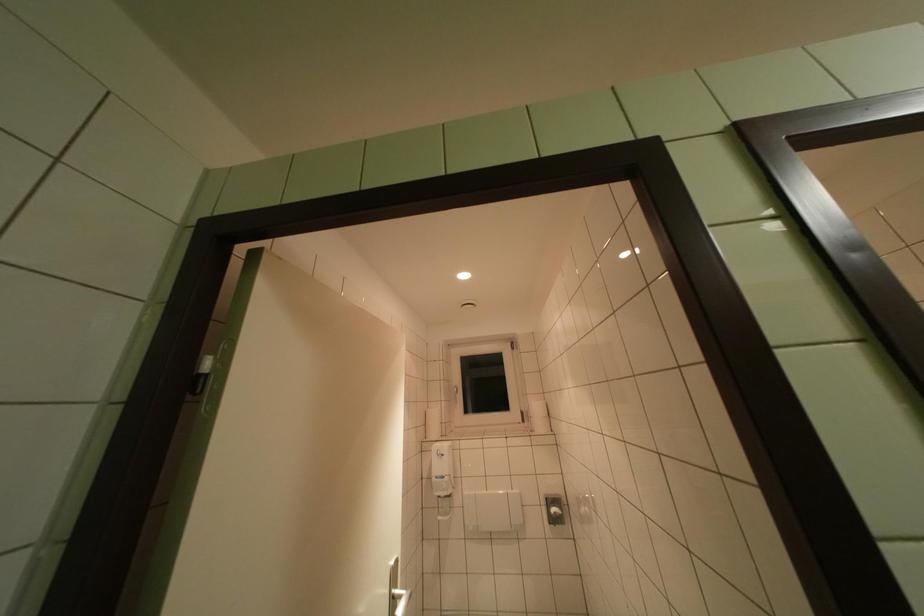
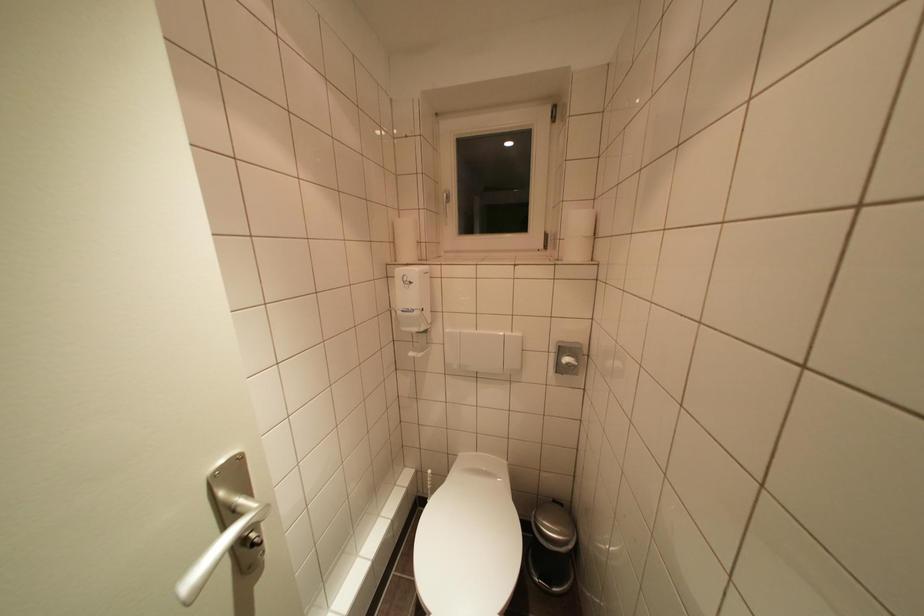
Locate, in the second image, the point that corresponds to (442,416) in the first image.

(416, 231)